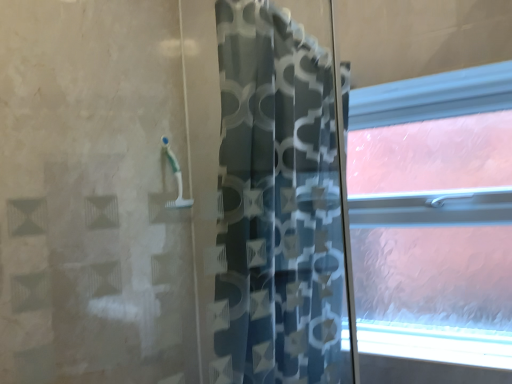
Question: Would you say white frosted glass at lower right is to the left or to the right of frosted glass window at right in the picture?

Choices:
 (A) right
 (B) left

Answer: (B)

Question: Is white frosted glass at lower right in front of or behind frosted glass window at right in the image?

Choices:
 (A) behind
 (B) front

Answer: (B)

Question: Which is nearer to the white frosted glass at lower right?

Choices:
 (A) frosted glass window at right
 (B) blue patterned curtain at center

Answer: (A)

Question: Which is nearer to the blue patterned curtain at center?

Choices:
 (A) frosted glass window at right
 (B) white frosted glass at lower right

Answer: (B)